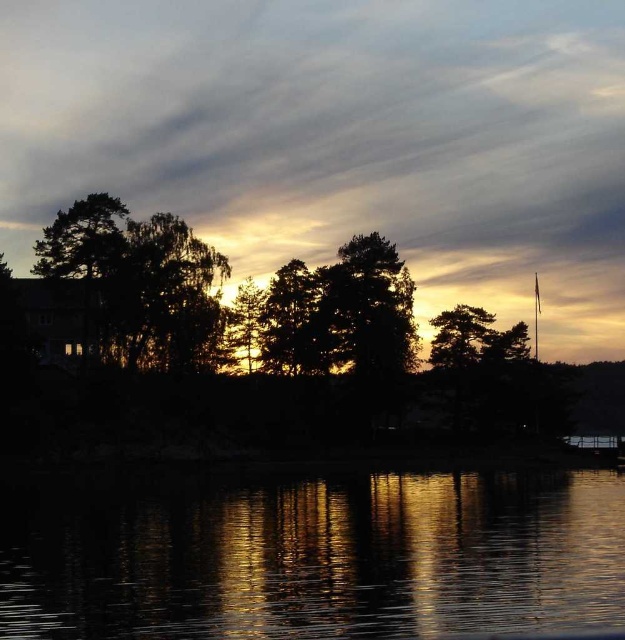
Does point (556, 124) lie in front of point (381, 364)?

No.

Is golden translucent clouds at upper center below silhouette tree at center?

Incorrect, golden translucent clouds at upper center is not positioned below silhouette tree at center.

Who is more forward, (338, 147) or (338, 266)?

Positioned in front is point (338, 266).

The height and width of the screenshot is (640, 625). I want to click on golden translucent clouds at upper center, so click(341, 140).

Can you confirm if silhouette tree at center is positioned below green matte tree at center?

Actually, silhouette tree at center is above green matte tree at center.

Can you confirm if silhouette tree at center is smaller than green matte tree at center?

Actually, silhouette tree at center might be larger than green matte tree at center.

Does point (401, 349) lie in front of point (310, 353)?

No, it is not.

The image size is (625, 640). Identify the location of silhouette tree at center. (368, 307).

Who is lower down, golden translucent clouds at upper center or glistening reflective water at center?

Positioned lower is glistening reflective water at center.

Which is more to the left, golden translucent clouds at upper center or glistening reflective water at center?

golden translucent clouds at upper center is more to the left.

Who is more distant from viewer, (375, 29) or (461, 512)?

Positioned behind is point (375, 29).

Where is `golden translucent clouds at upper center`? The height and width of the screenshot is (640, 625). golden translucent clouds at upper center is located at coordinates (341, 140).